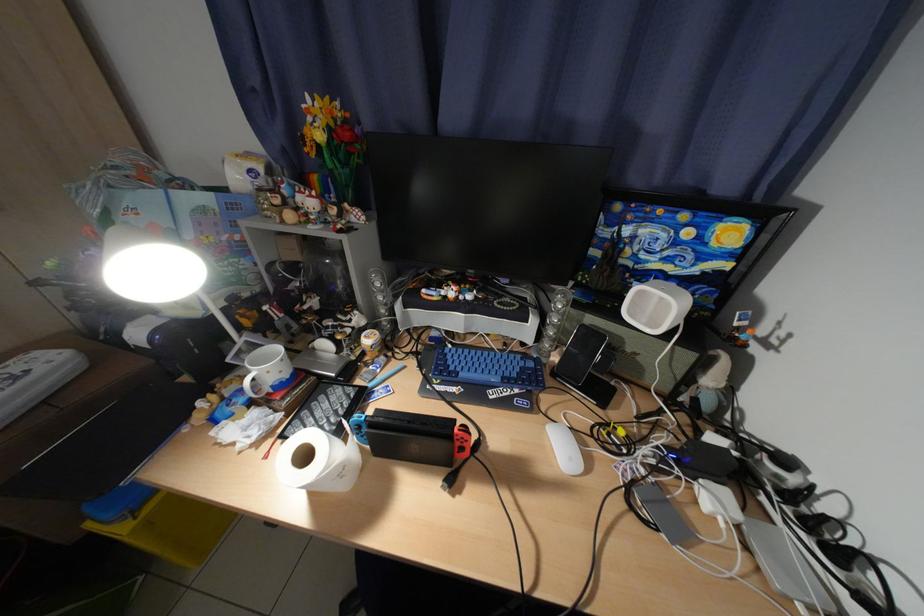
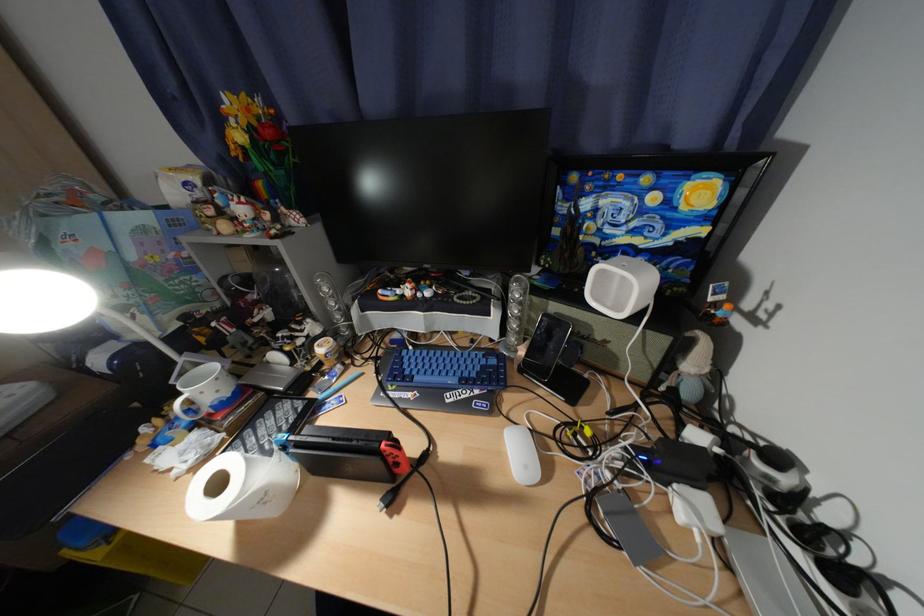
Locate, in the second image, the point that corresponds to point (473, 450) in the first image.

(408, 466)